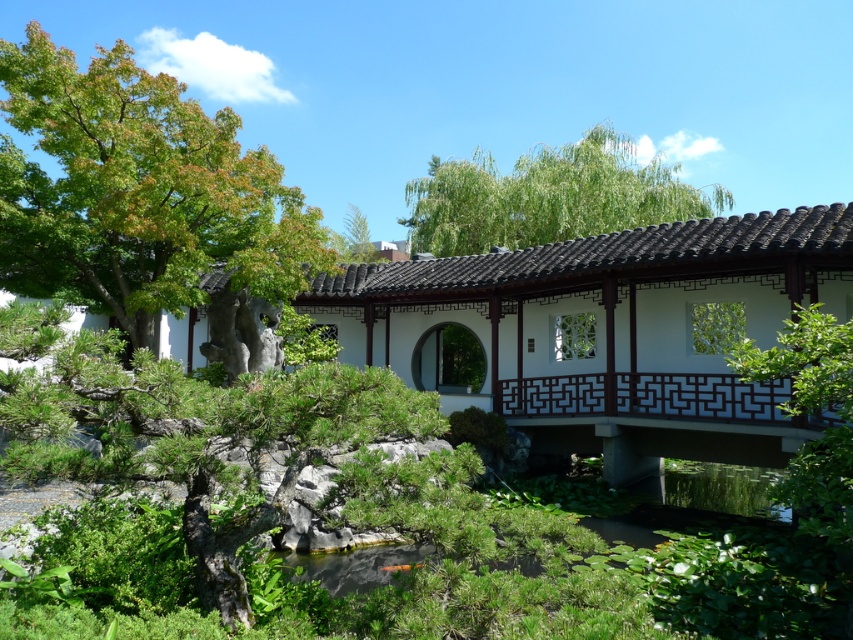
Does green leafy tree at left have a lesser width compared to green leafy tree at upper center?

Correct, green leafy tree at left's width is less than green leafy tree at upper center's.

Which is in front, point (114, 96) or point (607, 144)?

Positioned in front is point (114, 96).

Who is more forward, (252, 163) or (506, 186)?

Point (252, 163) is in front.

Find the location of a particular element. green leafy tree at left is located at coordinates (144, 202).

Between white wood bridge at center and green leafy tree at left, which one appears on the left side from the viewer's perspective?

green leafy tree at left is more to the left.

Does point (682, 336) come behind point (250, 163)?

Yes, it is.

The image size is (853, 640). Find the location of `white wood bridge at center`. white wood bridge at center is located at coordinates (608, 332).

Which of these two, white wood bridge at center or green leafy tree at upper center, stands taller?

green leafy tree at upper center

Does point (563, 326) come behind point (445, 243)?

No, (563, 326) is closer to viewer.

Where is `white wood bridge at center`? Image resolution: width=853 pixels, height=640 pixels. white wood bridge at center is located at coordinates (608, 332).